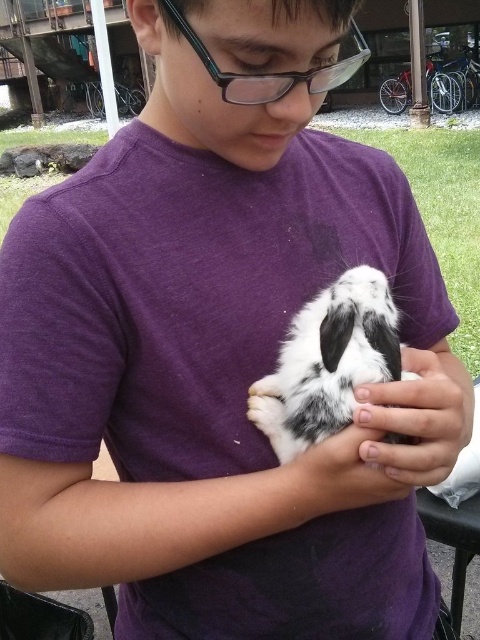
Question: Can you confirm if spotted fur rabbit at center is positioned below black plastic glasses at upper center?

Choices:
 (A) yes
 (B) no

Answer: (A)

Question: Which of the following is the closest to the observer?

Choices:
 (A) (458, 390)
 (B) (311, 84)
 (C) (340, 388)

Answer: (B)

Question: Which point is closer to the camera?

Choices:
 (A) (285, 365)
 (B) (177, 12)

Answer: (B)

Question: Considering the relative positions of spotted fur rabbit at center and smooth skin hand at center in the image provided, where is spotted fur rabbit at center located with respect to smooth skin hand at center?

Choices:
 (A) right
 (B) left

Answer: (B)

Question: Is spotted fur rabbit at center positioned behind smooth skin hand at center?

Choices:
 (A) yes
 (B) no

Answer: (A)

Question: Among these objects, which one is farthest from the camera?

Choices:
 (A) spotted fur rabbit at center
 (B) smooth skin hand at center
 (C) black plastic glasses at upper center

Answer: (A)